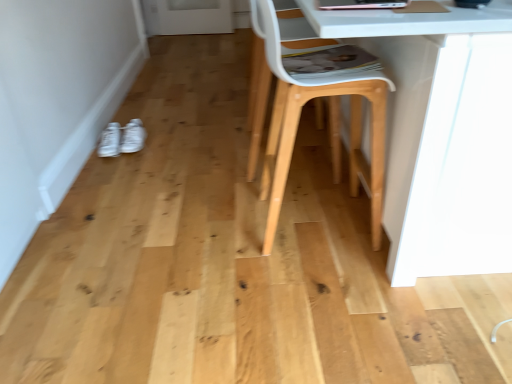
Question: Considering the relative sizes of white matte sneakers at lower left, positioned as the second footwear in left-to-right order, and white plastic swivel chair at center in the image provided, is white matte sneakers at lower left, positioned as the second footwear in left-to-right order, taller than white plastic swivel chair at center?

Choices:
 (A) yes
 (B) no

Answer: (B)

Question: Is white matte sneakers at lower left, positioned as the second footwear in left-to-right order, to the right of white plastic swivel chair at center from the viewer's perspective?

Choices:
 (A) yes
 (B) no

Answer: (B)

Question: Is white matte sneakers at lower left, the 1th footwear from the right, thinner than white plastic swivel chair at center?

Choices:
 (A) no
 (B) yes

Answer: (B)

Question: Is white matte sneakers at lower left, the 1th footwear from the right, turned away from white plastic swivel chair at center?

Choices:
 (A) yes
 (B) no

Answer: (B)

Question: Can you confirm if white matte sneakers at lower left, positioned as the second footwear in left-to-right order, is bigger than white plastic swivel chair at center?

Choices:
 (A) no
 (B) yes

Answer: (A)

Question: Does white matte sneakers at lower left, the 1th footwear from the right, have a greater width compared to white plastic swivel chair at center?

Choices:
 (A) no
 (B) yes

Answer: (A)

Question: Is white matte sneakers at lower left, the 1th footwear from the right, outside of natural wood chair at center?

Choices:
 (A) yes
 (B) no

Answer: (A)

Question: Considering the relative sizes of white matte sneakers at lower left, positioned as the second footwear in left-to-right order, and natural wood chair at center in the image provided, is white matte sneakers at lower left, positioned as the second footwear in left-to-right order, taller than natural wood chair at center?

Choices:
 (A) no
 (B) yes

Answer: (A)

Question: Is white matte sneakers at lower left, the 1th footwear from the right, further to camera compared to natural wood chair at center?

Choices:
 (A) no
 (B) yes

Answer: (B)

Question: Considering the relative positions of white matte sneakers at lower left, the 1th footwear from the right, and natural wood chair at center in the image provided, is white matte sneakers at lower left, the 1th footwear from the right, in front of natural wood chair at center?

Choices:
 (A) yes
 (B) no

Answer: (B)

Question: Considering the relative sizes of white matte sneakers at lower left, positioned as the second footwear in left-to-right order, and natural wood chair at center in the image provided, is white matte sneakers at lower left, positioned as the second footwear in left-to-right order, wider than natural wood chair at center?

Choices:
 (A) yes
 (B) no

Answer: (B)

Question: Considering the relative sizes of white matte sneakers at lower left, positioned as the second footwear in left-to-right order, and natural wood chair at center in the image provided, is white matte sneakers at lower left, positioned as the second footwear in left-to-right order, shorter than natural wood chair at center?

Choices:
 (A) yes
 (B) no

Answer: (A)

Question: Is natural wood chair at center located outside white matte sneakers at lower left, positioned as the second footwear in left-to-right order?

Choices:
 (A) no
 (B) yes

Answer: (B)